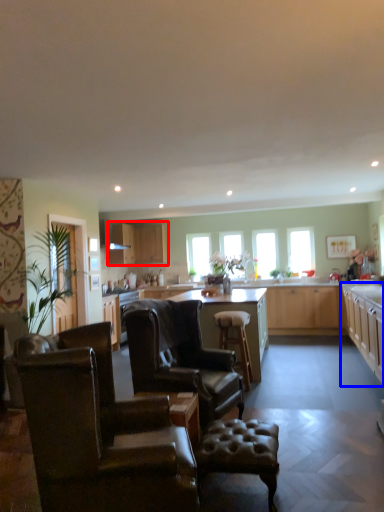
Question: Which object is closer to the camera taking this photo, cabinetry (highlighted by a red box) or cabinetry (highlighted by a blue box)?

Choices:
 (A) cabinetry
 (B) cabinetry

Answer: (B)